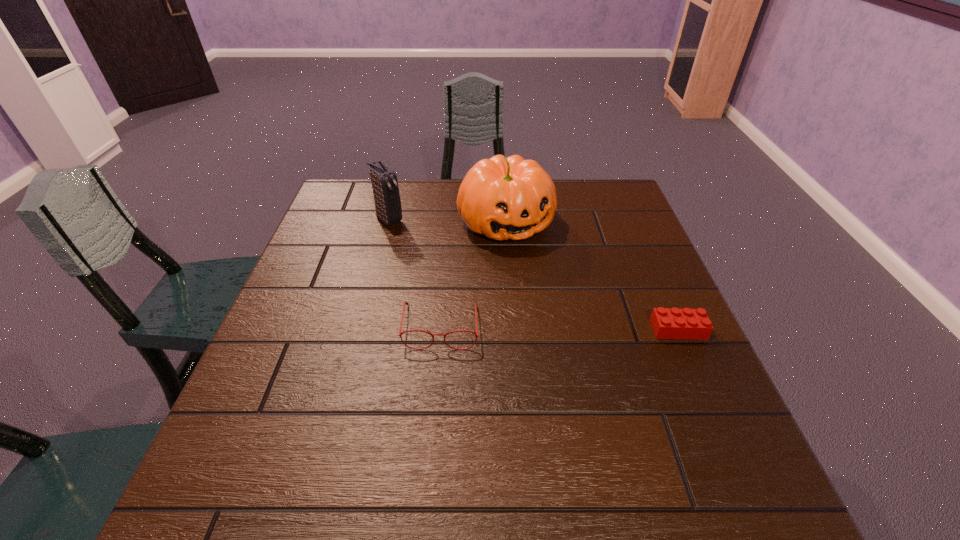
At what (x,y) coordinates should I click in order to perform the action: click on vacant space at the left edge. Please return your answer as a coordinate pair (x, y). The image size is (960, 540). Looking at the image, I should click on (252, 391).

This screenshot has width=960, height=540. I want to click on vacant space at the right edge, so click(x=628, y=319).

The width and height of the screenshot is (960, 540). Identify the location of free space at the near left corner of the desktop. (306, 416).

The height and width of the screenshot is (540, 960). I want to click on free point at the far right corner, so click(x=592, y=193).

This screenshot has height=540, width=960. What are the coordinates of `free area in between the pumpkin and the spectacles` in the screenshot? It's located at (473, 274).

The width and height of the screenshot is (960, 540). I want to click on blank region between the leftmost object and the rightmost object, so click(534, 274).

Locate an element on the screen. The image size is (960, 540). empty space that is in between the shortest object and the leftmost object is located at coordinates (534, 274).

Locate an element on the screen. The height and width of the screenshot is (540, 960). free spot between the clutch bag and the spectacles is located at coordinates (415, 273).

Identify the location of vacant point located between the spectacles and the clutch bag. This screenshot has width=960, height=540. (415, 273).

At what (x,y) coordinates should I click in order to perform the action: click on vacant region between the pumpkin and the third tallest object. Please return your answer as a coordinate pair (x, y). The height and width of the screenshot is (540, 960). Looking at the image, I should click on (473, 274).